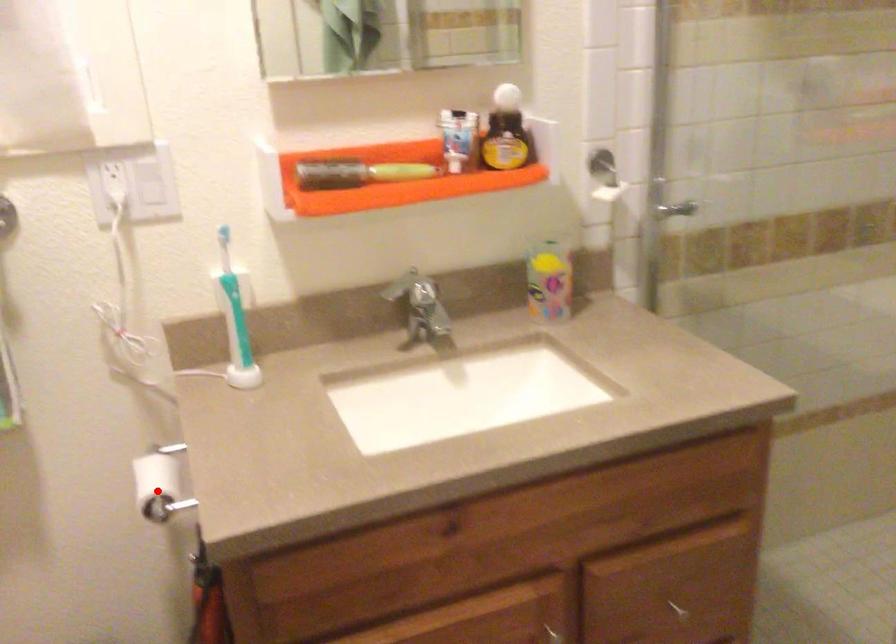
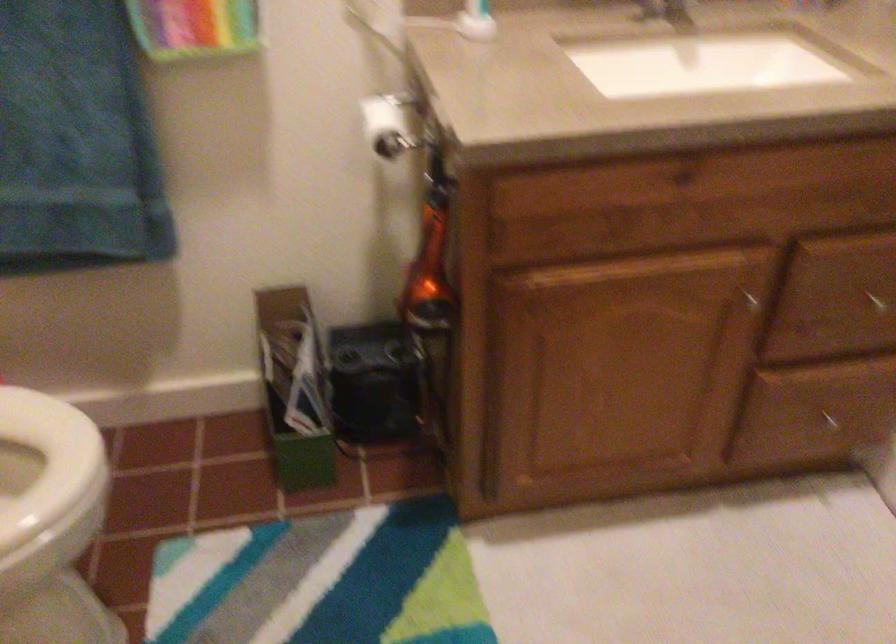
Find the pixel in the second image that matches the highlighted location in the first image.

(388, 125)